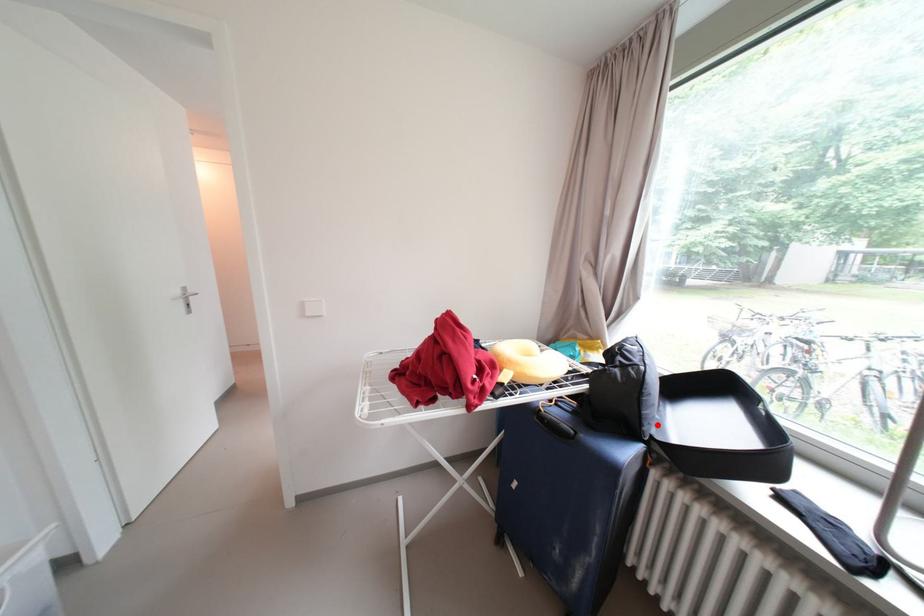
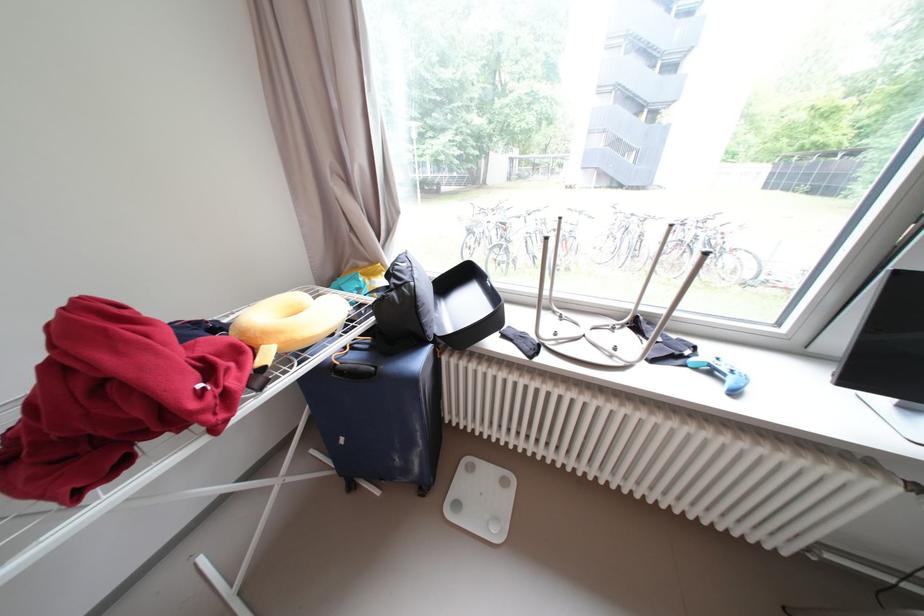
Find the pixel in the second image that matches the highlighted location in the first image.

(439, 328)